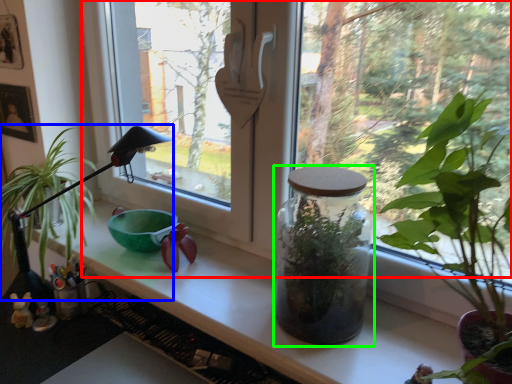
Question: Estimate the real-world distances between objects in this image. Which object is closer to window (highlighted by a red box), houseplant (highlighted by a blue box) or glass jar (highlighted by a green box)?

Choices:
 (A) houseplant
 (B) glass jar

Answer: (B)